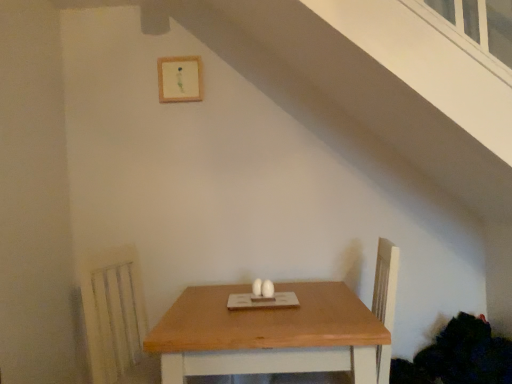
Question: From the image's perspective, is natural wood table at center positioned above or below wooden frame at upper center?

Choices:
 (A) above
 (B) below

Answer: (B)

Question: Is natural wood table at center in front of or behind wooden frame at upper center in the image?

Choices:
 (A) front
 (B) behind

Answer: (A)

Question: Is natural wood table at center inside or outside of wooden frame at upper center?

Choices:
 (A) inside
 (B) outside

Answer: (B)

Question: In the image, is wooden frame at upper center on the left side or the right side of natural wood table at center?

Choices:
 (A) right
 (B) left

Answer: (B)

Question: In terms of height, does wooden frame at upper center look taller or shorter compared to natural wood table at center?

Choices:
 (A) tall
 (B) short

Answer: (B)

Question: Is point (190, 57) positioned closer to the camera than point (199, 296)?

Choices:
 (A) farther
 (B) closer

Answer: (A)

Question: In the image, is wooden frame at upper center positioned in front of or behind natural wood table at center?

Choices:
 (A) behind
 (B) front

Answer: (A)